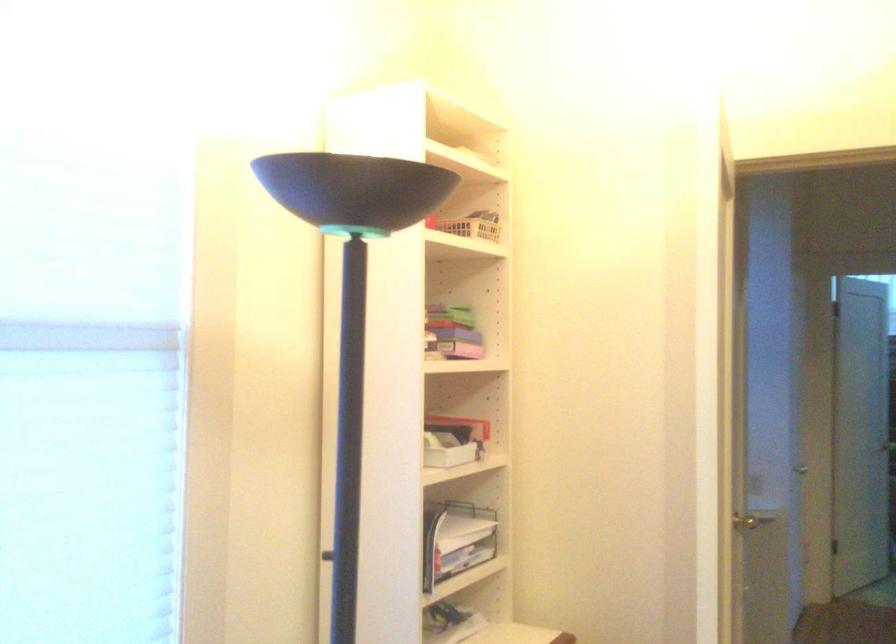
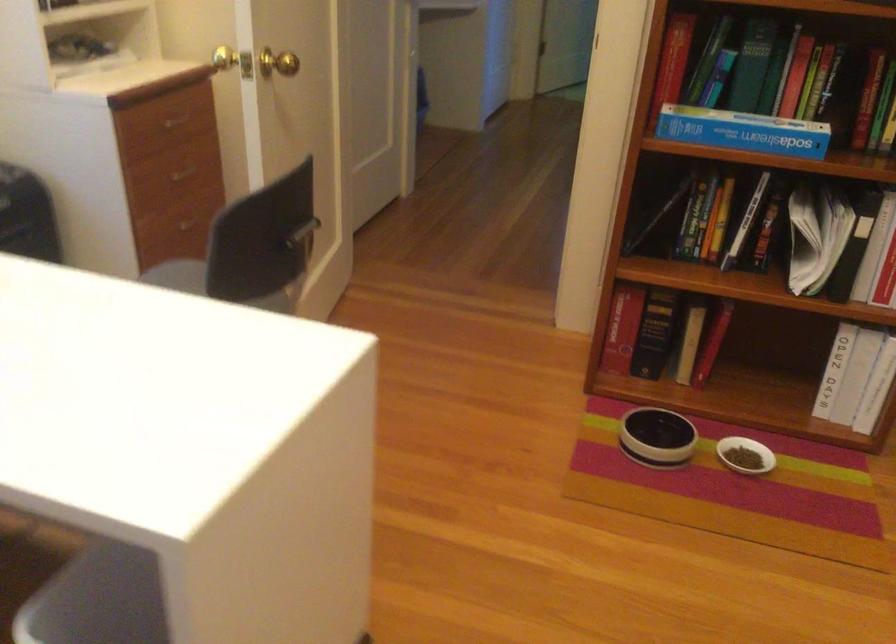
First-person continuous shooting, in which direction is the camera rotating?

The camera rotated toward right-down.